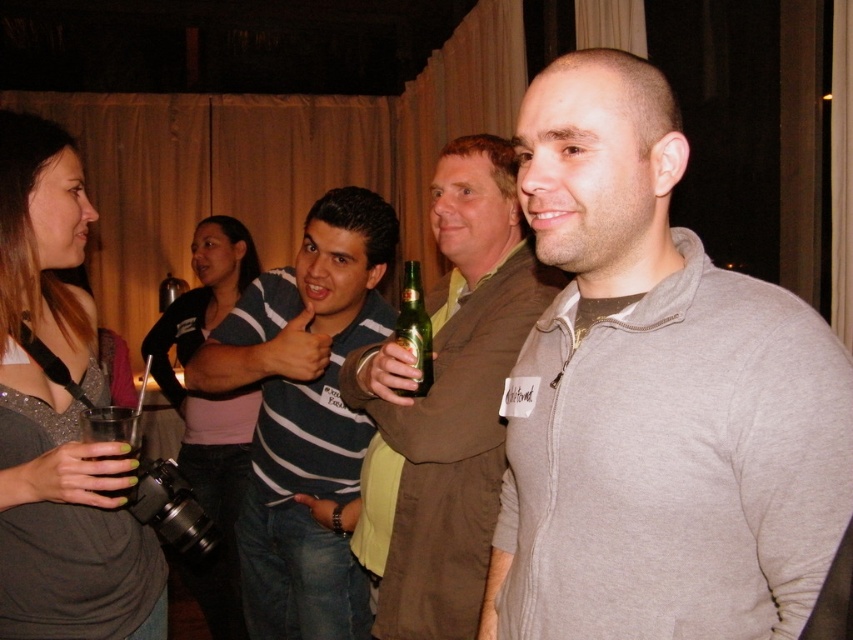
Question: Which point is closer to the camera?

Choices:
 (A) (416, 355)
 (B) (589, 232)
 (C) (483, 458)
 (D) (88, 460)

Answer: (B)

Question: Can you confirm if striped sweater at center is positioned below green glass bottle at center?

Choices:
 (A) no
 (B) yes

Answer: (B)

Question: Which point is farther to the camera?

Choices:
 (A) matte gray dress at left
 (B) striped sweater at center
 (C) green glass bottle at center
 (D) striped cotton shirt at center

Answer: (B)

Question: Can you confirm if gray zip-up sweater at center is positioned to the left of striped sweater at center?

Choices:
 (A) yes
 (B) no

Answer: (B)

Question: Does matte brown coat at center lie behind clear plastic cup at lower left?

Choices:
 (A) no
 (B) yes

Answer: (B)

Question: Estimate the real-world distances between objects in this image. Which object is closer to the green glass bottle at center?

Choices:
 (A) matte gray dress at left
 (B) matte brown coat at center

Answer: (B)